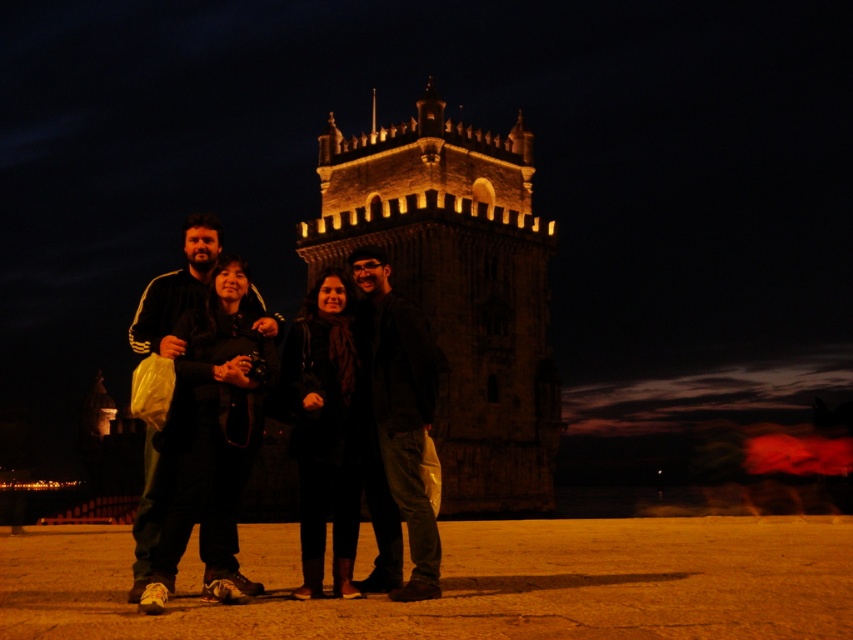
You are a photographer trying to capture a group photo in front of the brick stone tower at center. The group includes a person wearing black athletic wear at left. Considering the size of the tower and the person, which one appears wider in the photo?

The brick stone tower at center appears wider in the photo because its width is larger than that of the black athletic wear at left.

In the scene shown: You are a photographer trying to capture a group photo at night. You see the brick stone tower at center and the black athletic wear at left. Which object is located to the right of the other?

The brick stone tower at center is positioned on the right side of black athletic wear at left, so the tower is to the right of the person wearing black athletic wear.

Consider the image. You are standing in front of the historic stone tower and want to place two decorative lights at the coordinates point (x=196, y=224) and point (x=163, y=502). Which coordinate is closer to you?

Point (x=196, y=224) is closer to you because it is further to the viewer than point (x=163, y=502).